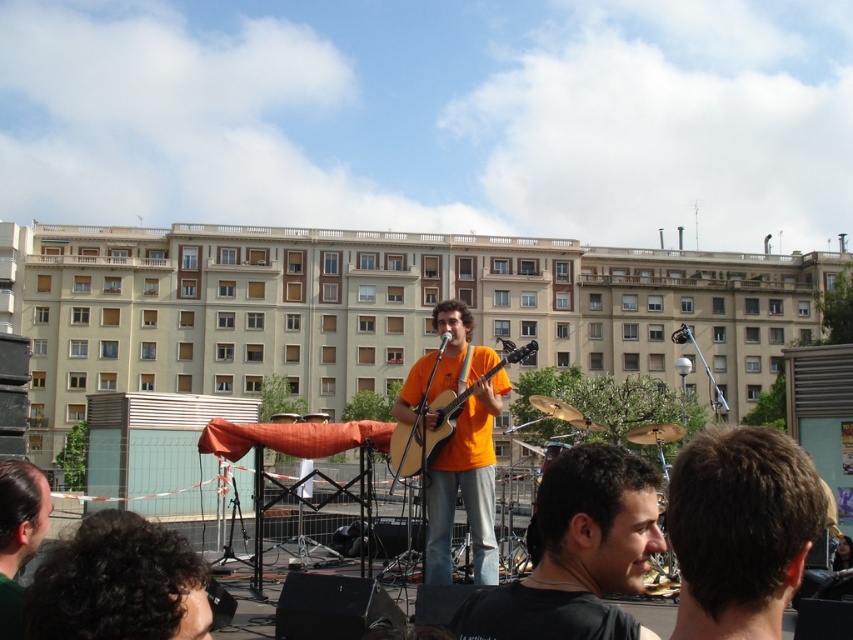
From the picture: You are a photographer taking a picture of the stage setup. You notice a point at coordinates (x=18, y=534) on your camera screen. What object does this point correspond to?

The point at coordinates (x=18, y=534) corresponds to the dark brown hair at lower left.

You are a photographer positioned at the back of the audience. You want to capture a clear photo of the acoustic wood guitar at center without the dark brown hair at center blocking it. What should you do?

The dark brown hair at center is in front of the acoustic wood guitar at center, so you should move to the side to avoid the obstruction caused by the dark brown hair at center.

You are a photographer at the back of the audience. You want to take a photo of the performer so that both the dark brown hair at center and the acoustic wood guitar at center are clearly visible. Based on their positions, which object should you focus on first to ensure both are in frame?

The dark brown hair at center is positioned under acoustic wood guitar at center, so you should focus on the acoustic wood guitar at center first to ensure both are in frame.